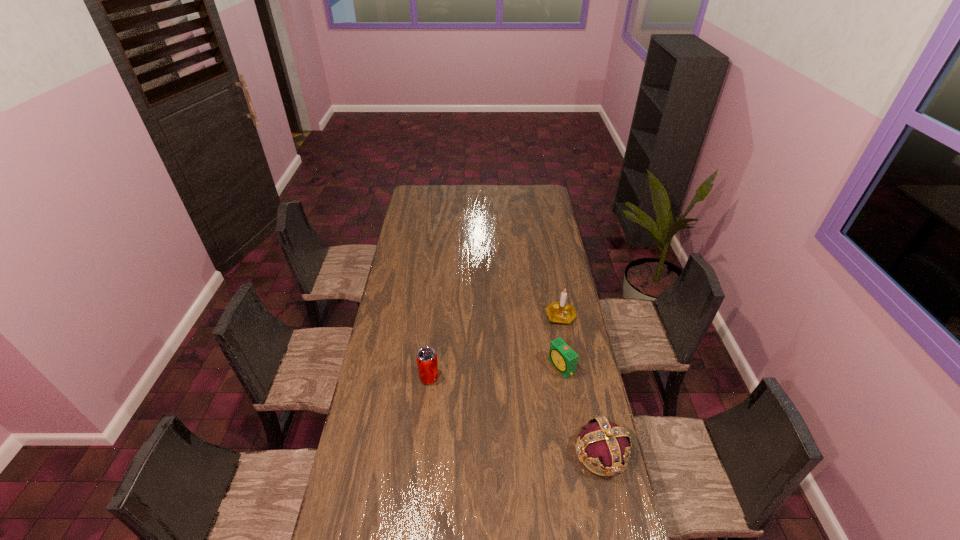
The height and width of the screenshot is (540, 960). Find the location of `soda can`. soda can is located at coordinates (427, 363).

You are a GUI agent. You are given a task and a screenshot of the screen. Output one action in this format:
    pyautogui.click(x=<x>, y=<y>)
    Task: Click on the crown
    The width and height of the screenshot is (960, 540).
    Given the screenshot: What is the action you would take?
    pyautogui.click(x=605, y=444)

This screenshot has height=540, width=960. In order to click on alarm clock in this screenshot , I will do `click(561, 356)`.

Find the location of a particular element. the farthest object is located at coordinates tap(561, 312).

The width and height of the screenshot is (960, 540). I want to click on free space located on the front of the leftmost object, so click(422, 440).

This screenshot has height=540, width=960. Identify the location of vacant space located on the front of the nearest object. (613, 509).

Where is `vacant space located 0.150m on the front-facing side of the alarm clock`? The height and width of the screenshot is (540, 960). vacant space located 0.150m on the front-facing side of the alarm clock is located at coordinates (522, 390).

This screenshot has height=540, width=960. What are the coordinates of `free space located on the front-facing side of the alarm clock` in the screenshot? It's located at (531, 385).

Find the location of a particular element. The image size is (960, 540). vacant region located 0.320m on the front-facing side of the alarm clock is located at coordinates (487, 410).

Locate an element on the screen. vacant space situated with a handle on the farthest object is located at coordinates (550, 345).